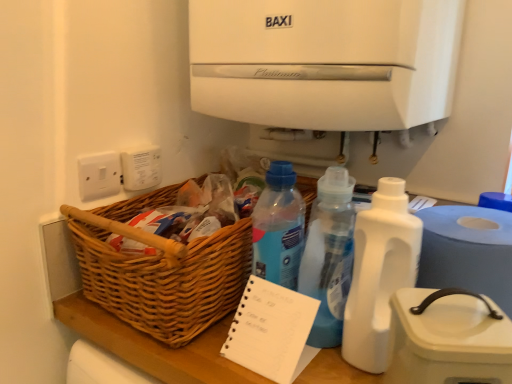
Question: Is white plastic bottle at center-right, arranged as the 1th bottle when viewed from the right, wider or thinner than white plastic container at right?

Choices:
 (A) wide
 (B) thin

Answer: (B)

Question: Relative to white plastic container at right, is white plastic bottle at center-right, placed as the 2th bottle when sorted from left to right, in front or behind?

Choices:
 (A) front
 (B) behind

Answer: (B)

Question: Considering the real-world distances, which object is farthest from the white matte water cooler at upper center?

Choices:
 (A) white plastic container at right
 (B) translucent plastic bottle at center, which appears as the 2th bottle when viewed from the right
 (C) woven wood basket at lower left
 (D) white plastic switch at left, the 2th electric outlet from the right
 (E) white spiral-bound notepad at center

Answer: (D)

Question: Which object is positioned closest to the white matte water cooler at upper center?

Choices:
 (A) white plastic paper towel at lower right
 (B) white plastic bottle at center-right, arranged as the 1th bottle when viewed from the right
 (C) white spiral-bound notepad at center
 (D) white plastic switch at left, the 2th electric outlet from the right
 (E) white plastic container at right

Answer: (B)